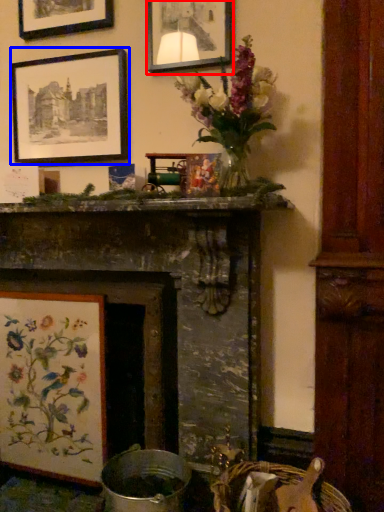
Question: Which object is closer to the camera taking this photo, picture frame (highlighted by a red box) or picture frame (highlighted by a blue box)?

Choices:
 (A) picture frame
 (B) picture frame

Answer: (A)